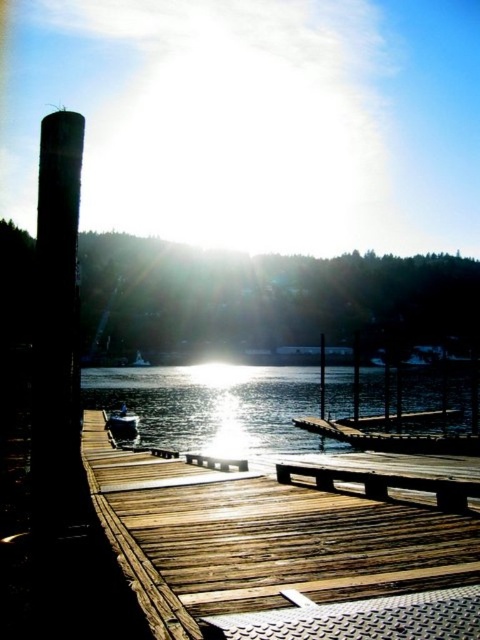
Question: Which object appears farthest from the camera in this image?

Choices:
 (A) wooden dock at center
 (B) white glossy boat at center

Answer: (B)

Question: Is wooden picnic table at center smaller than white glossy boat at center?

Choices:
 (A) yes
 (B) no

Answer: (B)

Question: Observing the image, what is the correct spatial positioning of glistening water at boat left in reference to white glossy boat at center?

Choices:
 (A) right
 (B) left

Answer: (A)

Question: Considering the relative positions of wooden dock at center and glistening water at boat left in the image provided, where is wooden dock at center located with respect to glistening water at boat left?

Choices:
 (A) left
 (B) right

Answer: (A)

Question: Among these points, which one is nearest to the camera?

Choices:
 (A) (213, 384)
 (B) (467, 484)
 (C) (132, 422)
 (D) (171, 541)

Answer: (D)

Question: Based on their relative distances, which object is nearer to the glistening water at boat left?

Choices:
 (A) wooden dock at center
 (B) wooden picnic table at center
 (C) white glossy boat at center

Answer: (C)